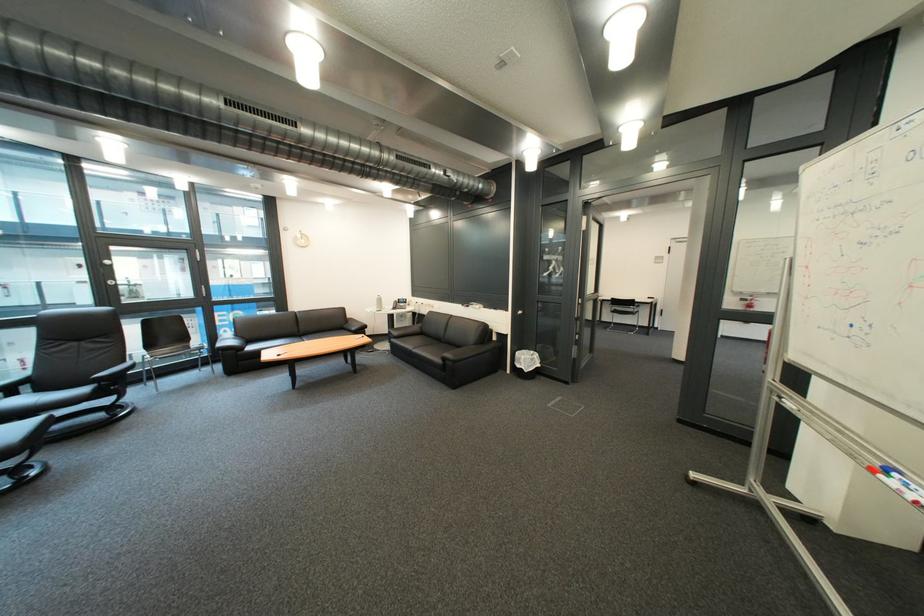
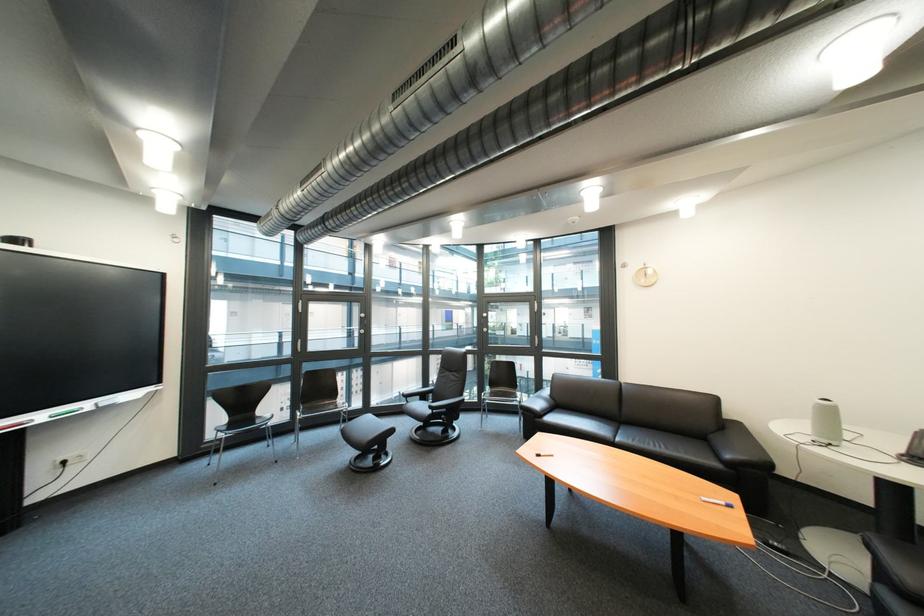
The point at [318,341] is marked in the first image. Where is the corresponding point in the second image?

(634, 434)